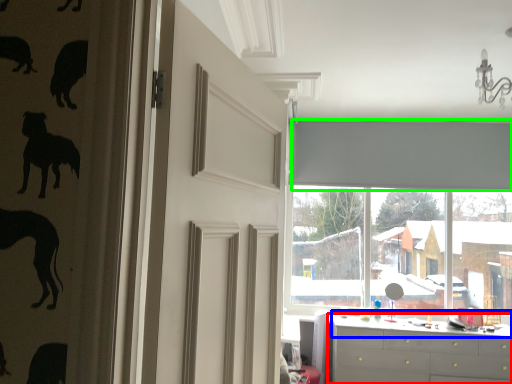
Question: Which is nearer to the chest of drawers (highlighted by a red box)? counter top (highlighted by a blue box) or curtain (highlighted by a green box).

Choices:
 (A) counter top
 (B) curtain

Answer: (A)